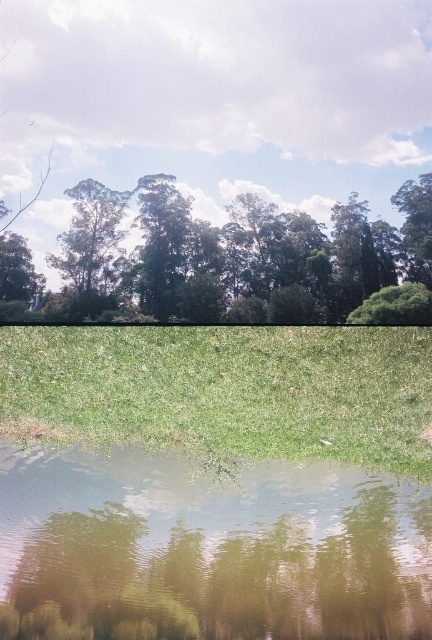
You are standing at the point marked as point (225,390) in the image. Looking around, you see the dense trees above and the water below. What surface are you currently standing on?

You are standing on green grass at lower center, as indicated by the point (225,390) being located there.

You are standing on the green grass at lower center and want to walk to the green leafy tree at upper center. Considering the distance between them, can you estimate how many steps it would take to reach the tree if each of your steps covers about 2.5 feet?

The distance between the green grass at lower center and the green leafy tree at upper center is 9.57 feet. Since each step covers approximately 2.5 feet, dividing 9.57 by 2.5 gives roughly 3.83 steps. Therefore, it would take about 4 steps to reach the tree.